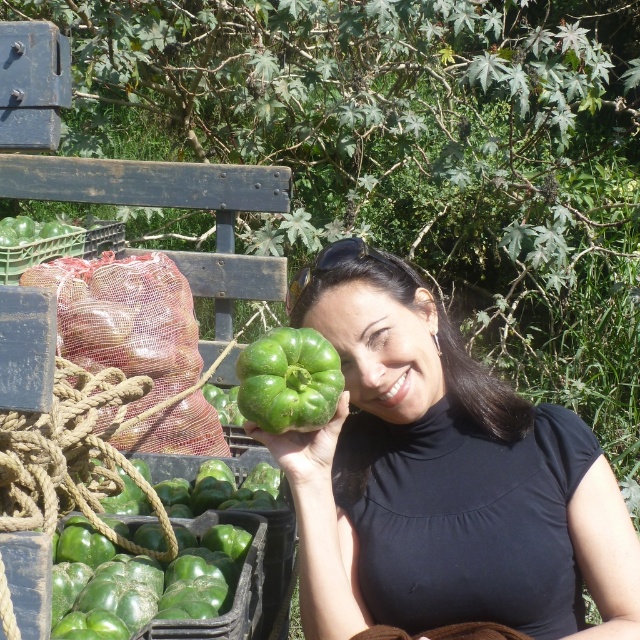
Question: Can you confirm if green matte pepper at center is thinner than green matte bell pepper at center?

Choices:
 (A) no
 (B) yes

Answer: (A)

Question: Is green matte pepper at center thinner than green matte bell pepper at center?

Choices:
 (A) no
 (B) yes

Answer: (A)

Question: Is green matte pepper at center below green matte bell pepper at center?

Choices:
 (A) no
 (B) yes

Answer: (B)

Question: Among these points, which one is nearest to the camera?

Choices:
 (A) (406, 321)
 (B) (317, 390)

Answer: (B)

Question: Which object is closer to the camera taking this photo?

Choices:
 (A) green matte pepper at center
 (B) green matte bell pepper at center

Answer: (B)